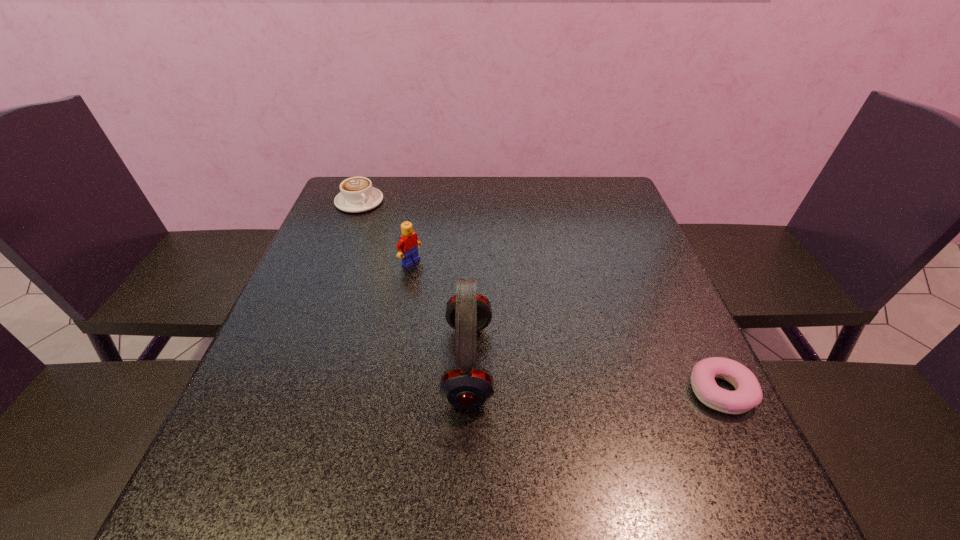
Where is `the tallest object`? This screenshot has width=960, height=540. the tallest object is located at coordinates [x=466, y=385].

You are a GUI agent. You are given a task and a screenshot of the screen. Output one action in this format:
    pyautogui.click(x=<x>, y=<y>)
    Task: Click on the earphone
    The width and height of the screenshot is (960, 540).
    Given the screenshot: What is the action you would take?
    pyautogui.click(x=466, y=385)

Image resolution: width=960 pixels, height=540 pixels. I want to click on the shortest object, so click(x=748, y=394).

At what (x,y) coordinates should I click in order to perform the action: click on the rightmost object. Please return your answer as a coordinate pair (x, y). Looking at the image, I should click on tap(748, 394).

At what (x,y) coordinates should I click in order to perform the action: click on the second shortest object. Please return your answer as a coordinate pair (x, y). Looking at the image, I should click on (357, 195).

This screenshot has width=960, height=540. I want to click on the leftmost object, so click(x=357, y=195).

What are the coordinates of `the third object from right to left` in the screenshot? It's located at (407, 249).

Locate an element on the screen. the second tallest object is located at coordinates (407, 249).

You are a GUI agent. You are given a task and a screenshot of the screen. Output one action in this format:
    pyautogui.click(x=<x>, y=<y>)
    Task: Click on the free spot located 0.110m on the ear cups of the tallest object
    The width and height of the screenshot is (960, 540).
    Given the screenshot: What is the action you would take?
    pyautogui.click(x=389, y=363)

This screenshot has width=960, height=540. I want to click on free location located on the ear cups of the tallest object, so click(x=283, y=363).